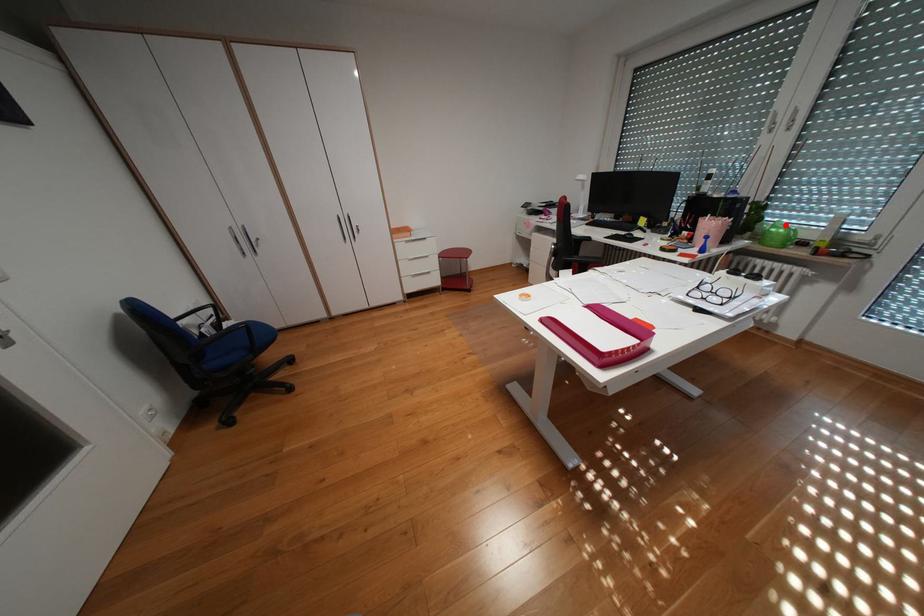
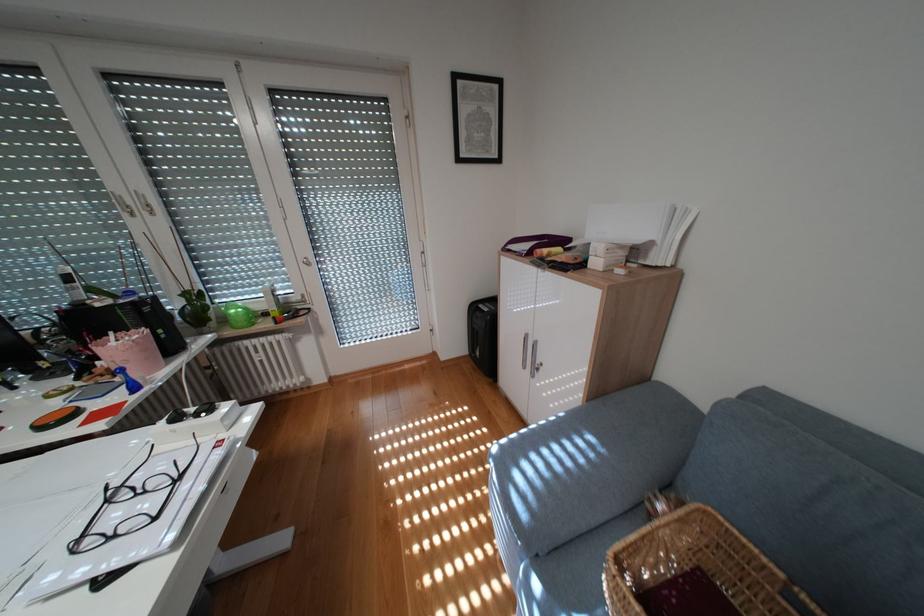
The point at the highlighted location is marked in the first image. Where is the corresponding point in the second image?

(239, 308)